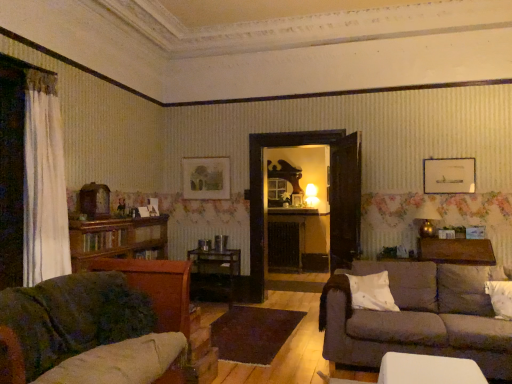
This screenshot has width=512, height=384. I want to click on vacant region above matte wooden picture frame at upper center, which ranks as the first picture frame in left-to-right order (from a real-world perspective), so click(197, 157).